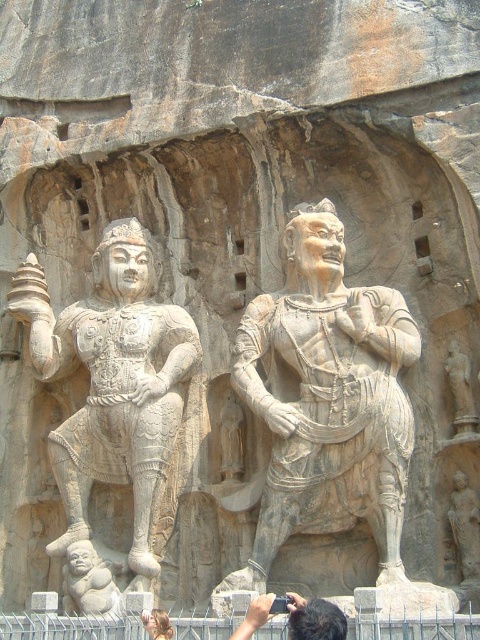
You are an archaeologist examining the rock face with two statues. You notice two points marked on the rock face at coordinates point (300,321) and point (298,621). Which point is closer to you as you stand in front of the rock face?

Point (300,321) is closer to you than point (298,621) because it is further to the viewer according to the description.

You are an archaeologist examining the rock face. You notice the stone warrior at center and the smooth stone baby at lower left. Which of these two figures is bigger in size?

The stone warrior at center is larger in size compared to the smooth stone baby at lower left.